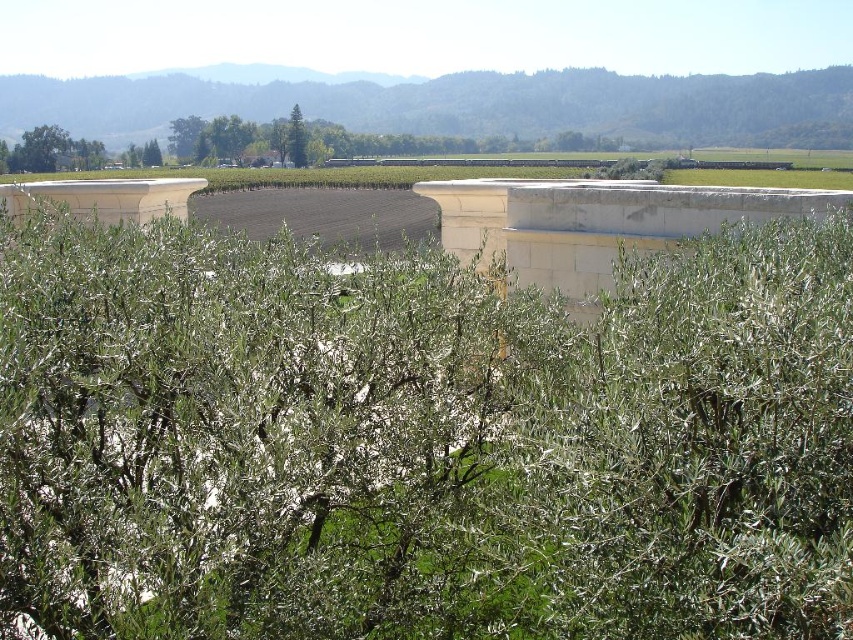
You are standing in a rural landscape with olive trees in the foreground and a curved stone structure in the midground. You notice two green leafy trees in the scene. One is labeled as the green leafy tree at center and the other as the green leafy tree at upper center. Which of these two trees is closer to you?

The green leafy tree at center is closer to you because it is positioned in front of the green leafy tree at upper center.

You are a landscape architect designing a walking path between the green leafy tree at center and the green leafy tree at upper center. The path must be straight and 2 meters wide. Can the path fit between them without overlapping either tree?

The distance between the green leafy tree at center and the green leafy tree at upper center is 35.62 meters. Since the path is only 2 meters wide, it can easily fit between them without overlapping either tree as the distance is significantly larger than the path width.

You are standing in a rural landscape and see two green leafy trees. One is labeled as the green leafy tree at center and the other as the green leafy tree at upper center. Which tree is positioned to the right of the other?

The green leafy tree at center is positioned to the right of the green leafy tree at upper center.